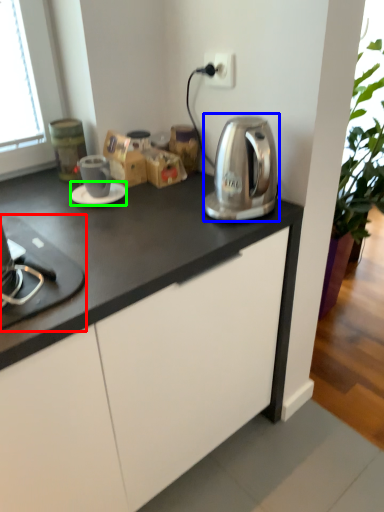
Question: Considering the real-world distances, which object is farthest from home appliance (highlighted by a red box)? kitchen appliance (highlighted by a blue box) or saucer (highlighted by a green box)?

Choices:
 (A) kitchen appliance
 (B) saucer

Answer: (A)